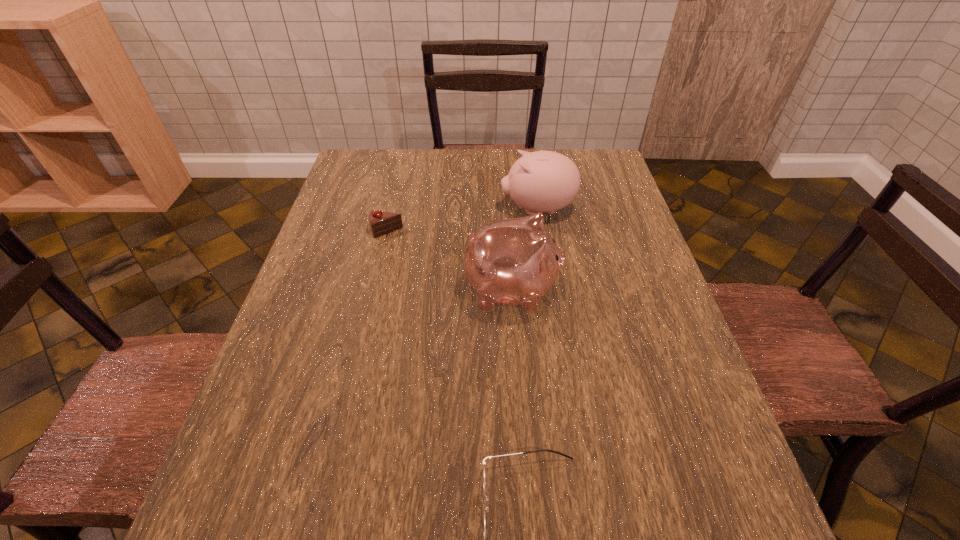
Find the location of `the nearer piggy bank`. the nearer piggy bank is located at coordinates (515, 261).

Image resolution: width=960 pixels, height=540 pixels. I want to click on the shorter piggy bank, so click(542, 181).

You are a GUI agent. You are given a task and a screenshot of the screen. Output one action in this format:
    pyautogui.click(x=<x>, y=<y>)
    Task: Click on the farther piggy bank
    Image resolution: width=960 pixels, height=540 pixels.
    Given the screenshot: What is the action you would take?
    pyautogui.click(x=542, y=181)

The height and width of the screenshot is (540, 960). I want to click on the second shortest object, so click(381, 222).

Identify the location of chocolate cake. The height and width of the screenshot is (540, 960). (381, 222).

The height and width of the screenshot is (540, 960). What are the coordinates of `free space located on the front facing side of the third farthest object` in the screenshot? It's located at (617, 291).

This screenshot has width=960, height=540. Find the location of `vacant space located at the snout of the shorter piggy bank`. vacant space located at the snout of the shorter piggy bank is located at coordinates (402, 209).

Locate an element on the screen. The image size is (960, 540). free space located 0.300m at the snout of the shorter piggy bank is located at coordinates (399, 209).

Where is `free space located at the snout of the shorter piggy bank`? The height and width of the screenshot is (540, 960). free space located at the snout of the shorter piggy bank is located at coordinates 416,209.

This screenshot has width=960, height=540. Identify the location of free location located on the left of the second shortest object. (322, 231).